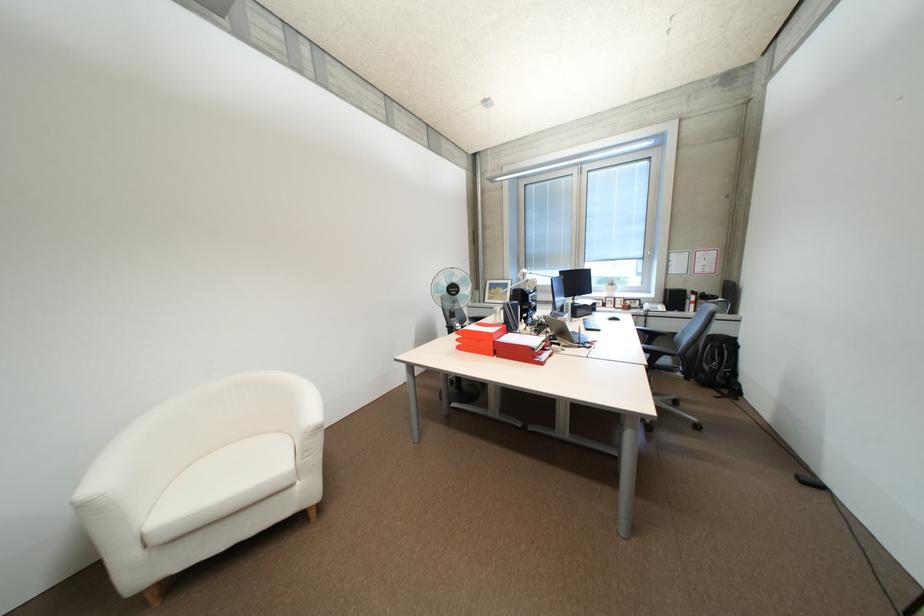
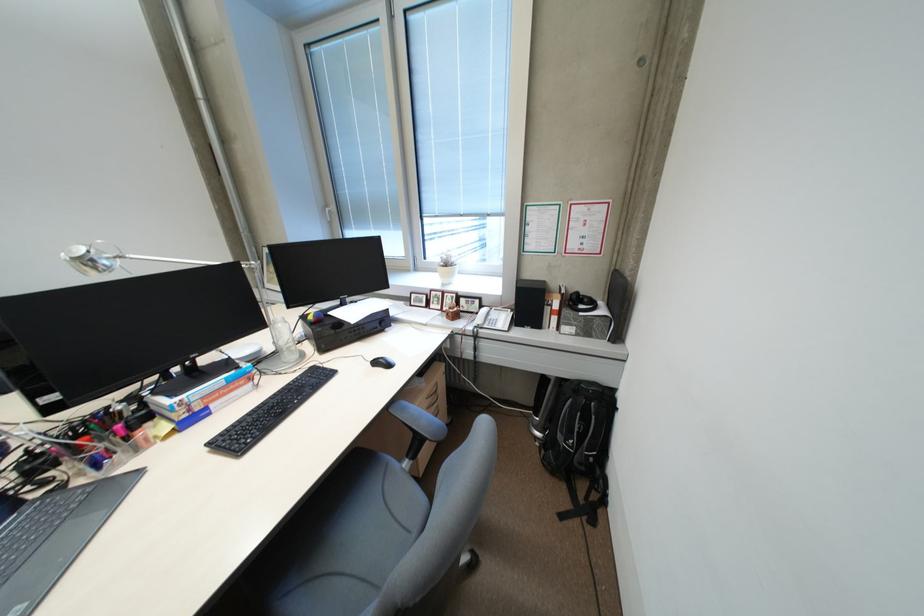
Locate, in the second image, the point that corresponds to point 651,306 in the first image.

(487, 314)